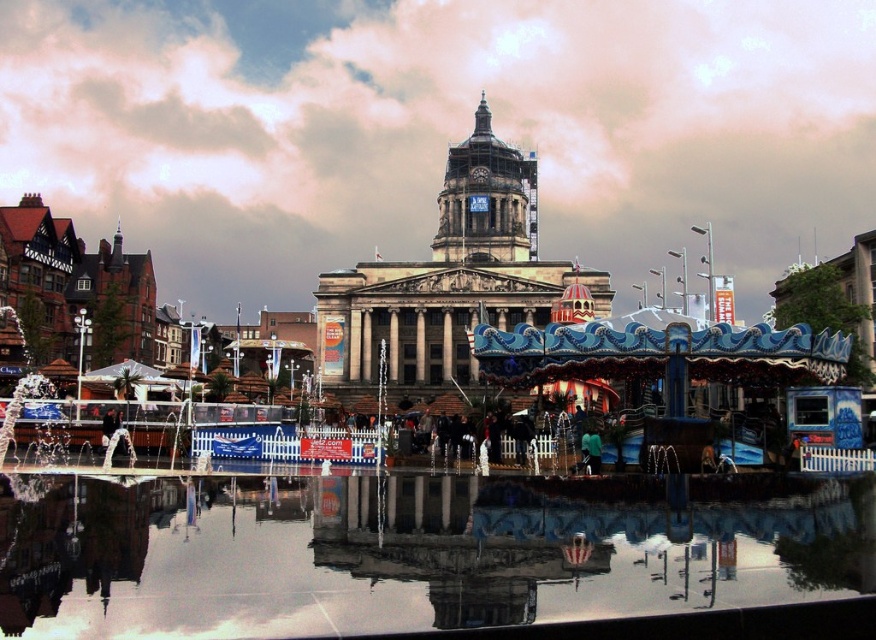
Question: Which object is closer to the camera taking this photo?

Choices:
 (A) blue painted wood carousel at center
 (B) stone clock tower at center

Answer: (A)

Question: Is blue painted wood carousel at center further to the viewer compared to gray stone clock tower at center?

Choices:
 (A) no
 (B) yes

Answer: (A)

Question: From the image, what is the correct spatial relationship of reflective glass water at center in relation to blue painted wood carousel at center?

Choices:
 (A) above
 (B) below

Answer: (B)

Question: Considering the real-world distances, which object is closest to the blue painted wood carousel at center?

Choices:
 (A) reflective glass water at center
 (B) gray stone clock tower at center
 (C) stone clock tower at center

Answer: (C)

Question: Is the position of reflective glass water at center more distant than that of stone clock tower at center?

Choices:
 (A) yes
 (B) no

Answer: (B)

Question: Which object is positioned closest to the stone clock tower at center?

Choices:
 (A) blue painted wood carousel at center
 (B) gray stone clock tower at center

Answer: (B)